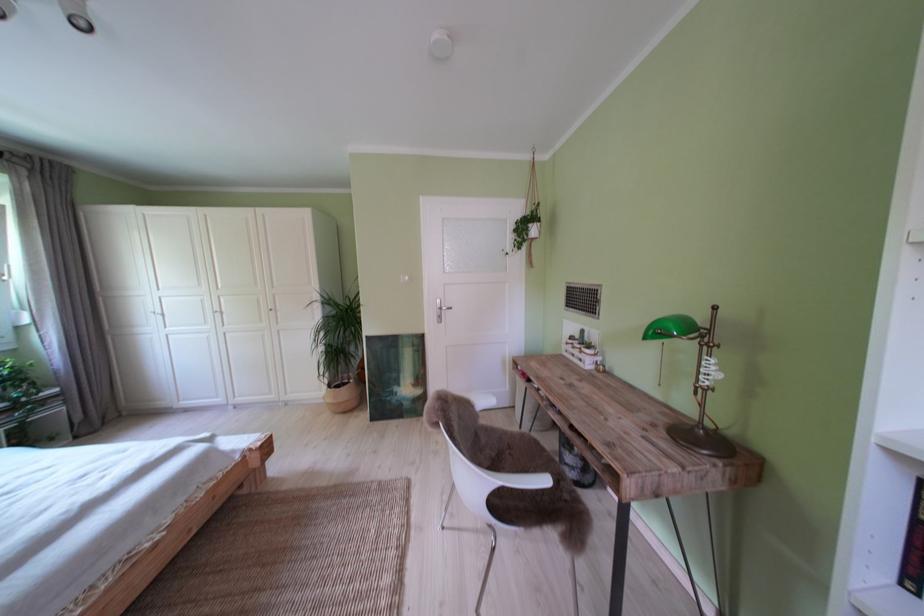
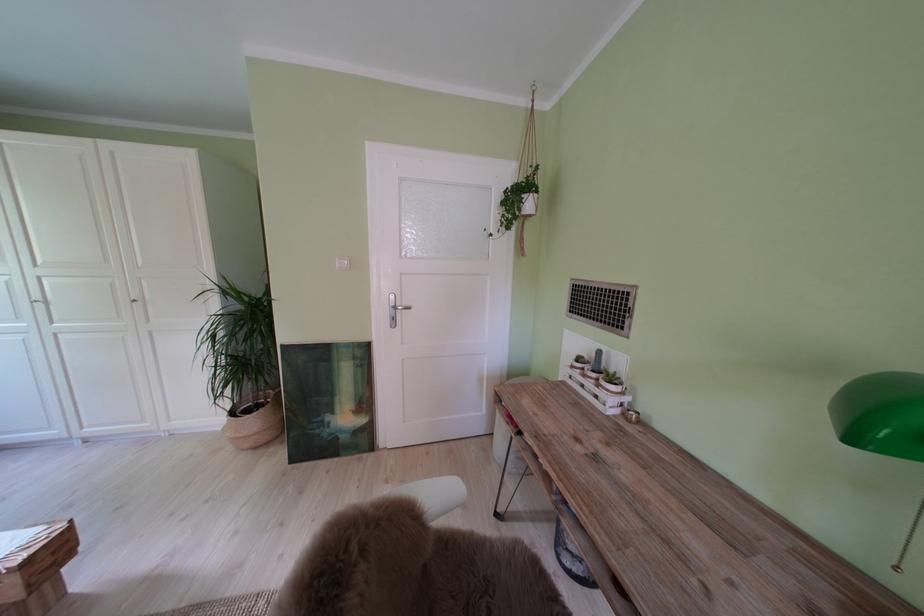
Locate, in the second image, the point that corresponds to (x=341, y=392) in the first image.

(242, 418)